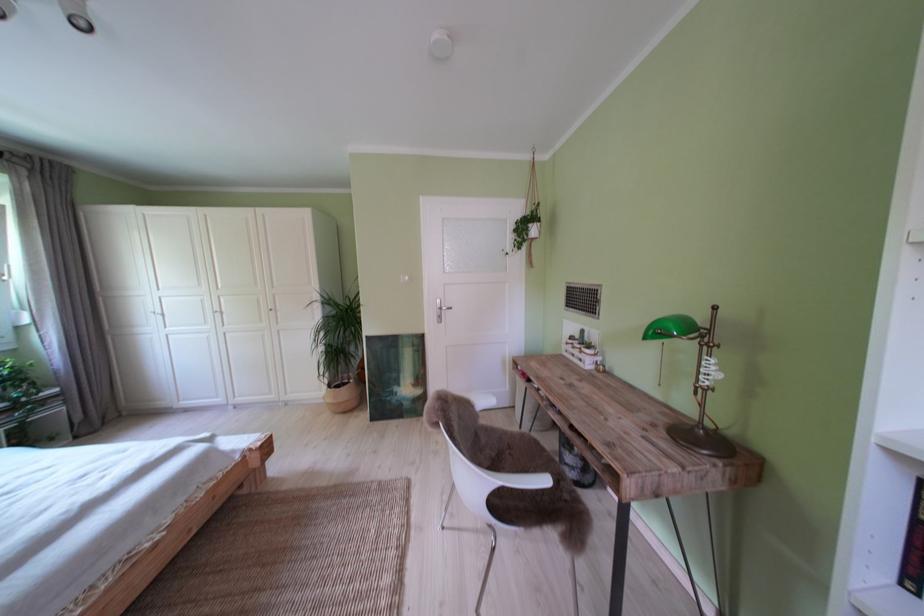
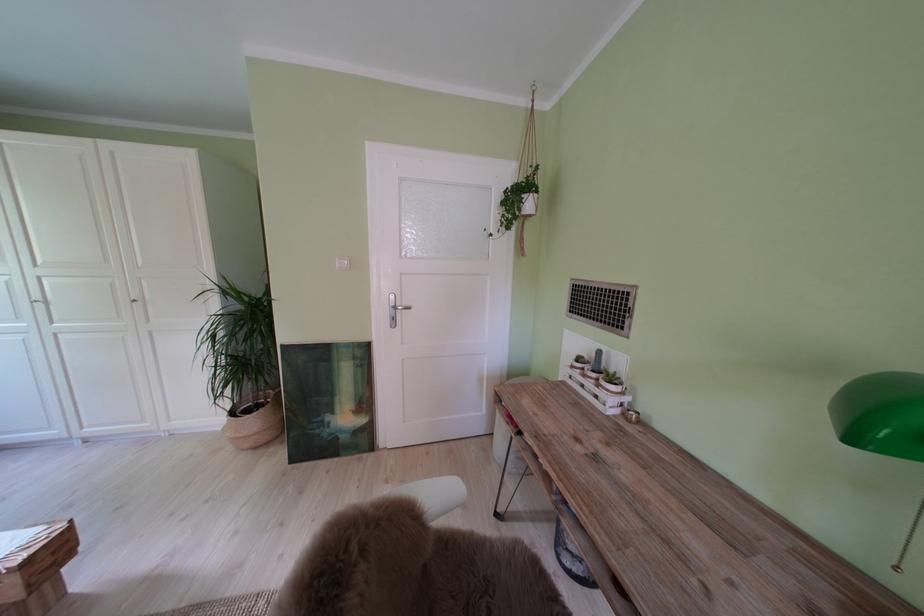
Locate, in the second image, the point that corresponds to (x=341, y=392) in the first image.

(242, 418)